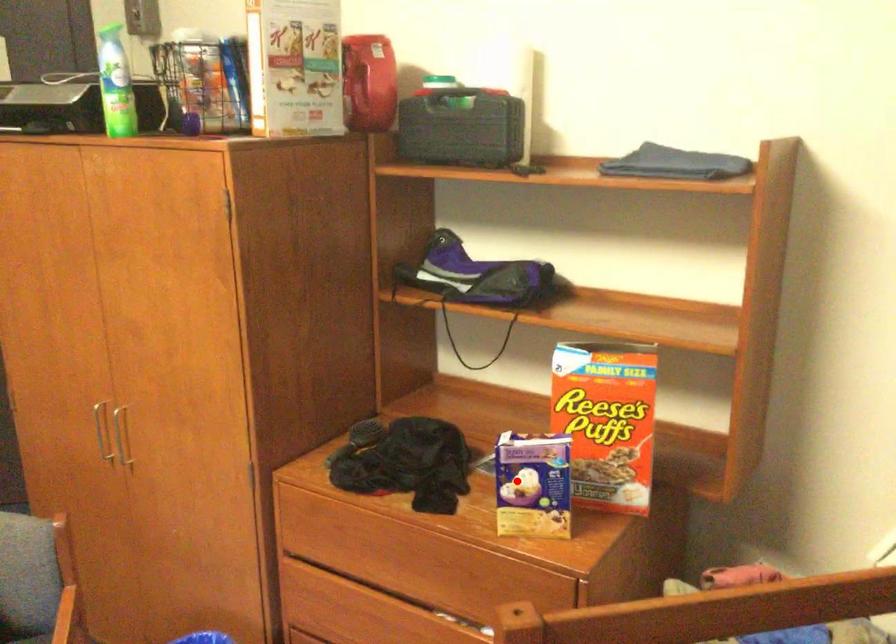
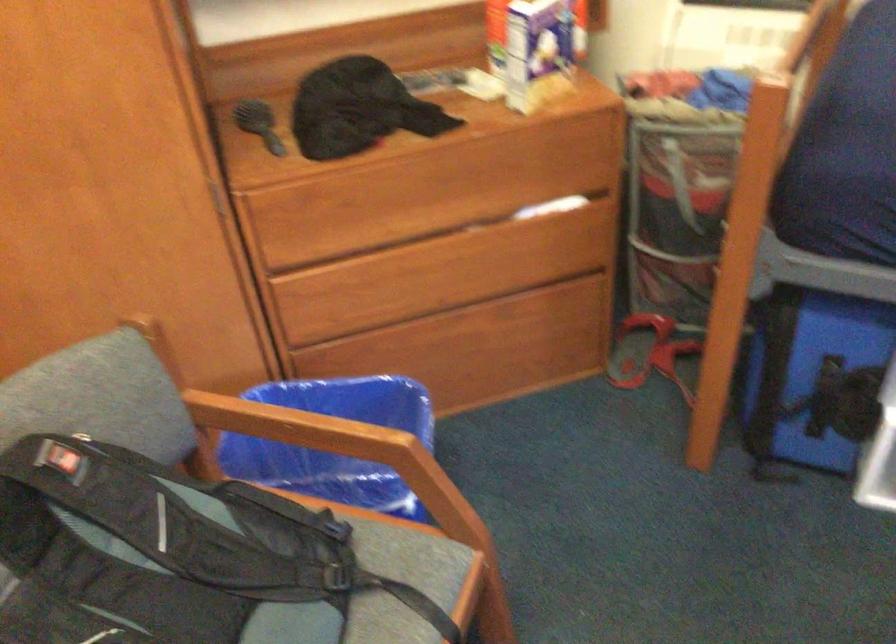
Find the pixel in the second image that matches the highlighted location in the first image.

(531, 50)